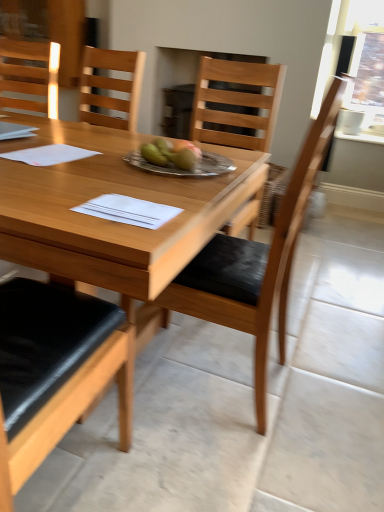
The image size is (384, 512). I want to click on spots to the right of wooden chair at center, marked as the second chair in a top-to-bottom arrangement, so click(326, 388).